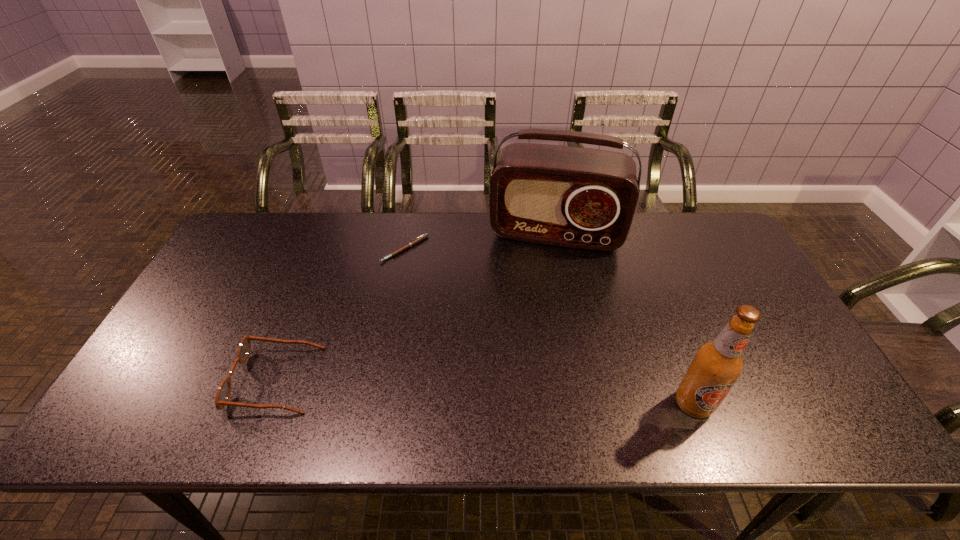
Identify the location of vacant space located at the nib of the third object from right to left. (416, 339).

The image size is (960, 540). What are the coordinates of `free space located at the nib of the third object from right to left` in the screenshot? It's located at (417, 354).

The height and width of the screenshot is (540, 960). I want to click on free spot located on the front panel of the radio receiver, so click(541, 286).

Find the location of a particular element. The image size is (960, 540). vacant space positioned on the front panel of the radio receiver is located at coordinates (536, 325).

Identify the location of vacant point located 0.060m on the front panel of the radio receiver. The image size is (960, 540). point(544,268).

Identify the location of pen that is positioned at the far edge. (423, 236).

Image resolution: width=960 pixels, height=540 pixels. I want to click on radio receiver situated at the far edge, so click(582, 198).

I want to click on spectacles positioned at the near edge, so click(x=223, y=393).

Find the location of a particular element. This screenshot has height=540, width=960. beer bottle that is at the near edge is located at coordinates (718, 364).

Image resolution: width=960 pixels, height=540 pixels. In the image, there is a desktop. What are the coordinates of `vacant space at the far edge` in the screenshot? It's located at (640, 251).